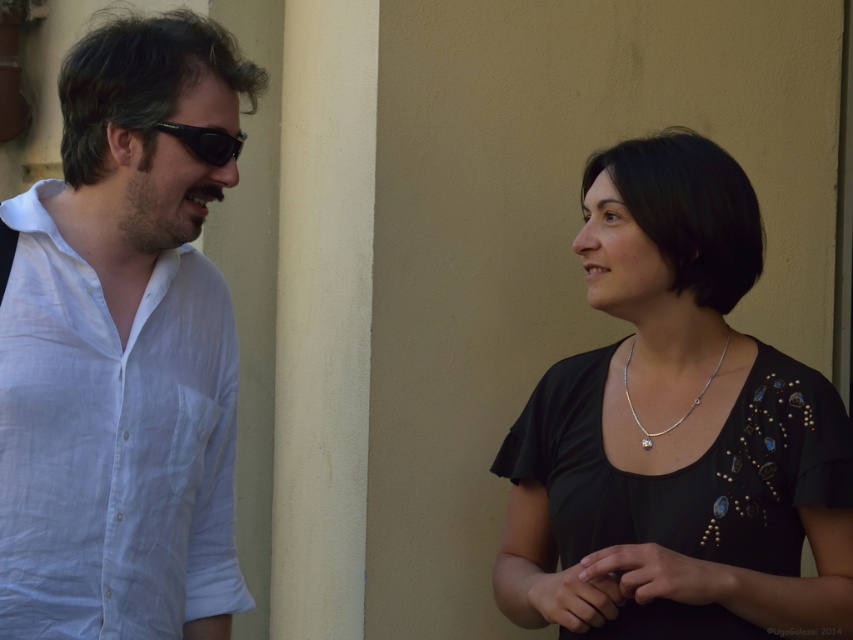
Question: Which point appears farthest from the camera in this image?

Choices:
 (A) (73, 396)
 (B) (204, 156)
 (C) (518, 600)
 (D) (672, 422)

Answer: (C)

Question: Is the position of black plastic sunglasses at left less distant than that of silver/golden chain at center?

Choices:
 (A) yes
 (B) no

Answer: (A)

Question: Is black satin dress at right positioned behind black plastic sunglasses at left?

Choices:
 (A) no
 (B) yes

Answer: (B)

Question: Which object is closer to the camera taking this photo?

Choices:
 (A) black plastic sunglasses at left
 (B) white linen shirt at left
 (C) black satin dress at right
 (D) silver/golden chain at center

Answer: (B)

Question: Is black satin dress at right above black plastic sunglasses at left?

Choices:
 (A) yes
 (B) no

Answer: (B)

Question: Based on their relative distances, which object is nearer to the black satin dress at right?

Choices:
 (A) white linen shirt at left
 (B) silver/golden chain at center
 (C) black plastic sunglasses at left

Answer: (B)